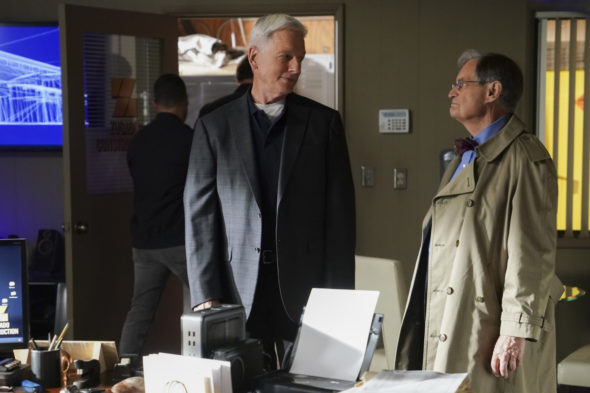
The width and height of the screenshot is (590, 393). What are the coordinates of `door` in the screenshot? It's located at (109, 240).